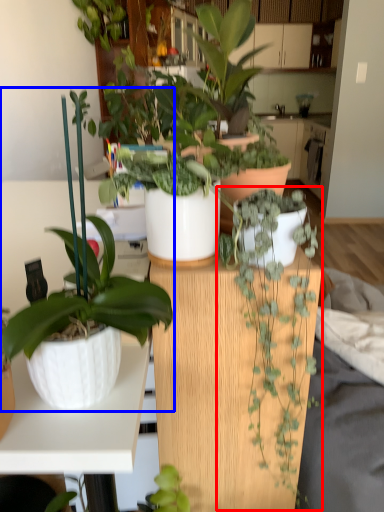
Question: Among these objects, which one is farthest to the camera, houseplant (highlighted by a red box) or houseplant (highlighted by a blue box)?

Choices:
 (A) houseplant
 (B) houseplant

Answer: (A)